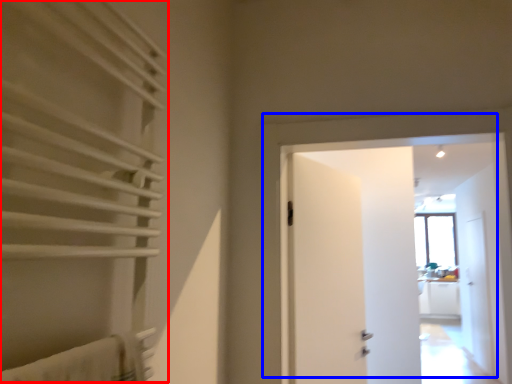
Question: Which object appears farthest to the camera in this image, curtain (highlighted by a red box) or door (highlighted by a blue box)?

Choices:
 (A) curtain
 (B) door

Answer: (B)